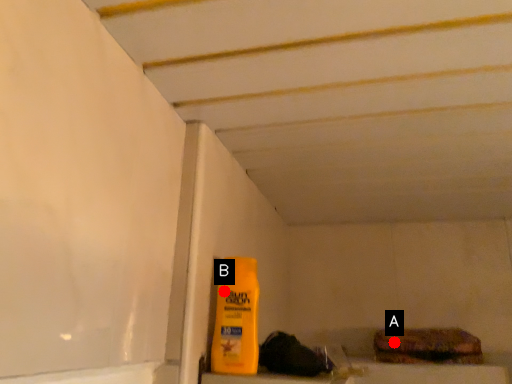
Question: Two points are circled on the image, labeled by A and B beside each circle. Among these points, which one is nearest to the camera?

Choices:
 (A) A is closer
 (B) B is closer

Answer: (B)